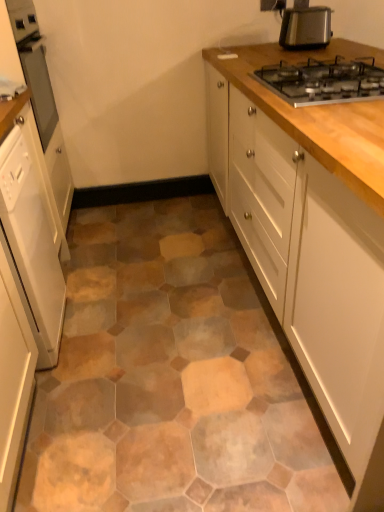
Question: Is white glossy cabinet at left, the second cabinetry positioned from the right, at the back of metallic silver gas stove at upper right?

Choices:
 (A) no
 (B) yes

Answer: (A)

Question: Would you say metallic silver gas stove at upper right is a long distance from white glossy cabinet at left, the second cabinetry positioned from the right?

Choices:
 (A) yes
 (B) no

Answer: (A)

Question: Is white glossy cabinet at left, which is counted as the 2th cabinetry, starting from the left, a part of metallic silver gas stove at upper right?

Choices:
 (A) yes
 (B) no

Answer: (B)

Question: Is metallic silver gas stove at upper right bigger than white glossy cabinet at left, the second cabinetry positioned from the right?

Choices:
 (A) no
 (B) yes

Answer: (A)

Question: Does metallic silver gas stove at upper right have a greater height compared to white glossy cabinet at left, which is counted as the 2th cabinetry, starting from the left?

Choices:
 (A) no
 (B) yes

Answer: (A)

Question: Is metallic silver gas stove at upper right outside of white glossy cabinet at left, which is counted as the 2th cabinetry, starting from the left?

Choices:
 (A) no
 (B) yes

Answer: (B)

Question: Does metallic silver gas stove at upper right appear on the left side of white glossy dishwasher at left, marked as the first cabinetry in a left-to-right arrangement?

Choices:
 (A) no
 (B) yes

Answer: (A)

Question: Could white glossy dishwasher at left, marked as the first cabinetry in a left-to-right arrangement, be considered to be inside metallic silver gas stove at upper right?

Choices:
 (A) no
 (B) yes

Answer: (A)

Question: Is metallic silver gas stove at upper right bigger than white glossy dishwasher at left, marked as the first cabinetry in a left-to-right arrangement?

Choices:
 (A) no
 (B) yes

Answer: (A)

Question: From a real-world perspective, is metallic silver gas stove at upper right on top of white glossy dishwasher at left, which is the third cabinetry from right to left?

Choices:
 (A) yes
 (B) no

Answer: (A)

Question: Is metallic silver gas stove at upper right far from white glossy dishwasher at left, which is the third cabinetry from right to left?

Choices:
 (A) yes
 (B) no

Answer: (A)

Question: Could you tell me if metallic silver gas stove at upper right is turned towards white glossy dishwasher at left, marked as the first cabinetry in a left-to-right arrangement?

Choices:
 (A) no
 (B) yes

Answer: (A)

Question: Can you confirm if white wood cabinet at upper right, which ranks as the 3th cabinetry in left-to-right order, is thinner than metallic silver toaster at upper right?

Choices:
 (A) no
 (B) yes

Answer: (A)